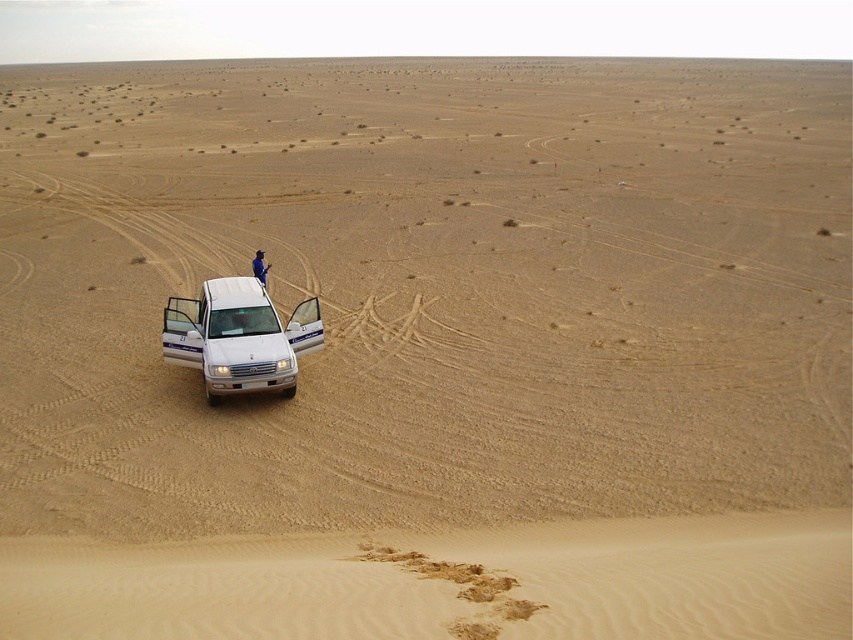
You are planning to take a photo of the white matte jeep at lower left and the blue fabric person at center in the desert scene. To ensure both are fully visible in the frame, should you adjust your camera to focus on the wider object first?

The white matte jeep at lower left might be wider than blue fabric person at center, so you should focus on the white matte jeep at lower left first to ensure it fits in the frame.

You are a hiker who needs to reach the blue fabric person at center from the white matte jeep at lower left. Which direction should you move relative to the jeep?

The white matte jeep at lower left is positioned on the right side of blue fabric person at center, so you should move to the left relative to the jeep to reach the blue fabric person at center.